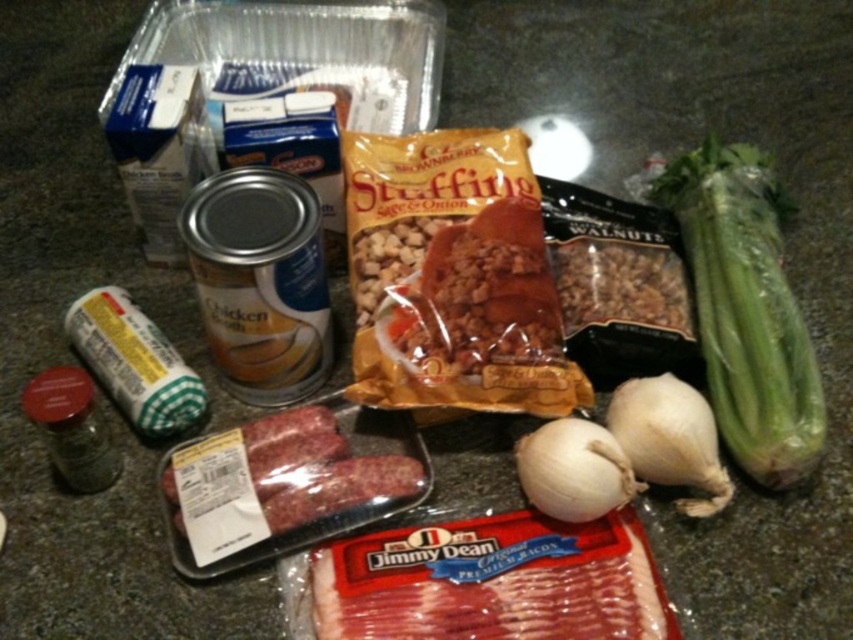
You are a chef organizing ingredients for a recipe. You need to place the green leafy celery at right and the white matte garlic at lower right into a drawer that can only accommodate items up to 15 cm in height. Given their height difference, which item might not fit if the drawer has limited vertical space?

The green leafy celery at right is much taller than the white matte garlic at lower right, so it might not fit in the drawer if the drawer has limited vertical space.

Which object is at the point (747, 310)?

The green leafy celery at right is located at point (747, 310).